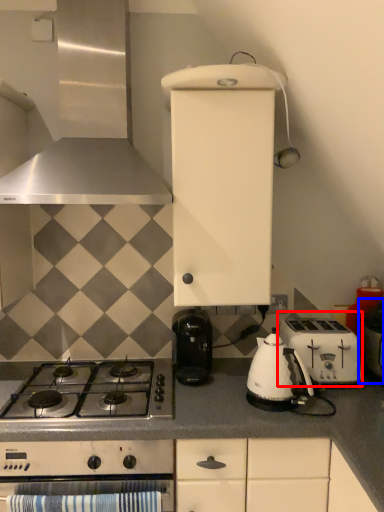
Question: Which object appears closest to the camera in this image, toaster (highlighted by a red box) or appliance (highlighted by a blue box)?

Choices:
 (A) toaster
 (B) appliance

Answer: (B)